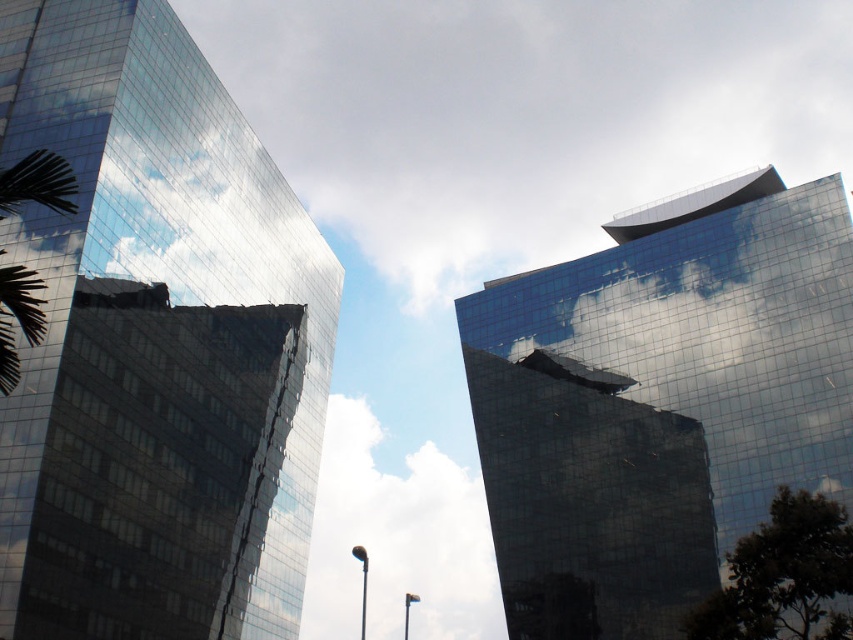
Question: Which object is the closest to the shiny glass building at upper right?

Choices:
 (A) green leafy palm tree at left
 (B) shiny glass building at left
 (C) white fluffy cloud at center
 (D) white glossy cloud at upper center

Answer: (B)

Question: Is white glossy cloud at upper center further to camera compared to white fluffy cloud at center?

Choices:
 (A) yes
 (B) no

Answer: (B)

Question: From the image, what is the correct spatial relationship of shiny glass building at left in relation to green leafy palm tree at left?

Choices:
 (A) left
 (B) right

Answer: (A)

Question: Considering the real-world distances, which object is closest to the white fluffy cloud at center?

Choices:
 (A) shiny glass building at left
 (B) white glossy cloud at upper center
 (C) shiny glass building at upper right

Answer: (A)

Question: Can you confirm if white fluffy cloud at center is smaller than green leafy palm tree at left?

Choices:
 (A) yes
 (B) no

Answer: (B)

Question: Estimate the real-world distances between objects in this image. Which object is farther from the shiny glass building at upper right?

Choices:
 (A) shiny glass building at left
 (B) green leafy palm tree at left

Answer: (B)